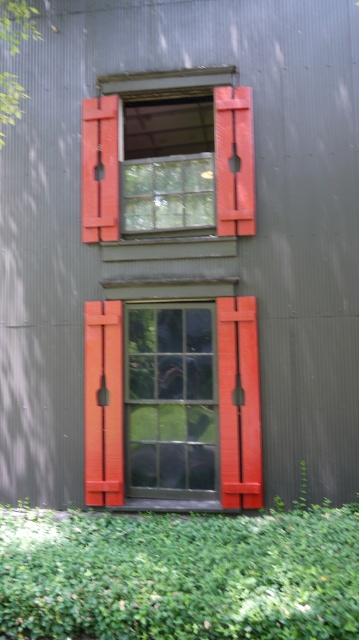
You are standing in front of the building and want to know the exact position of the green leafy hedge at lower center. According to the coordinates provided, where is it located?

The green leafy hedge at lower center is located at coordinates point (179,576).

You are a gardener planning to trim the green leafy hedge at lower center and the matte glass window at center. Which object requires more horizontal space to work around?

The green leafy hedge at lower center requires more horizontal space to work around because its width is larger than the matte glass window at center.